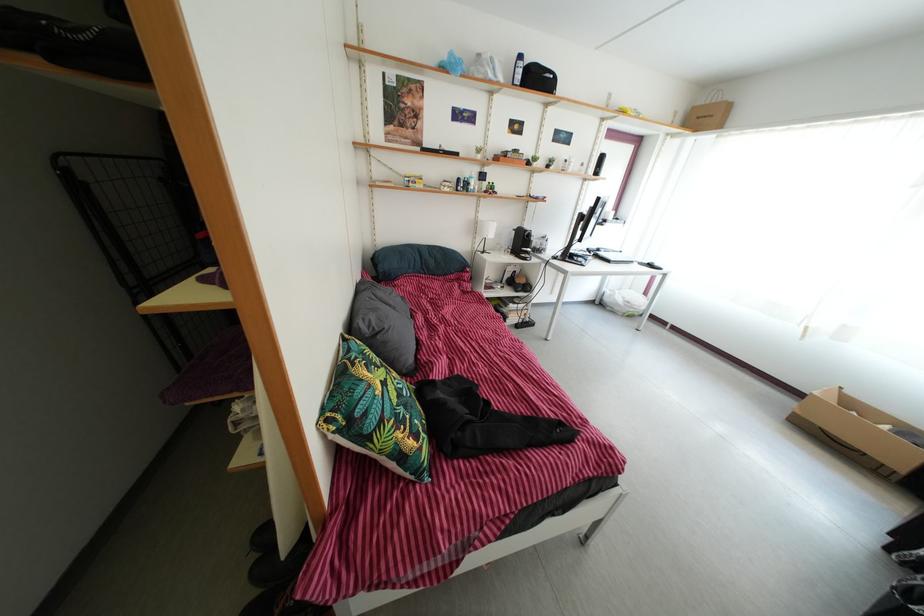
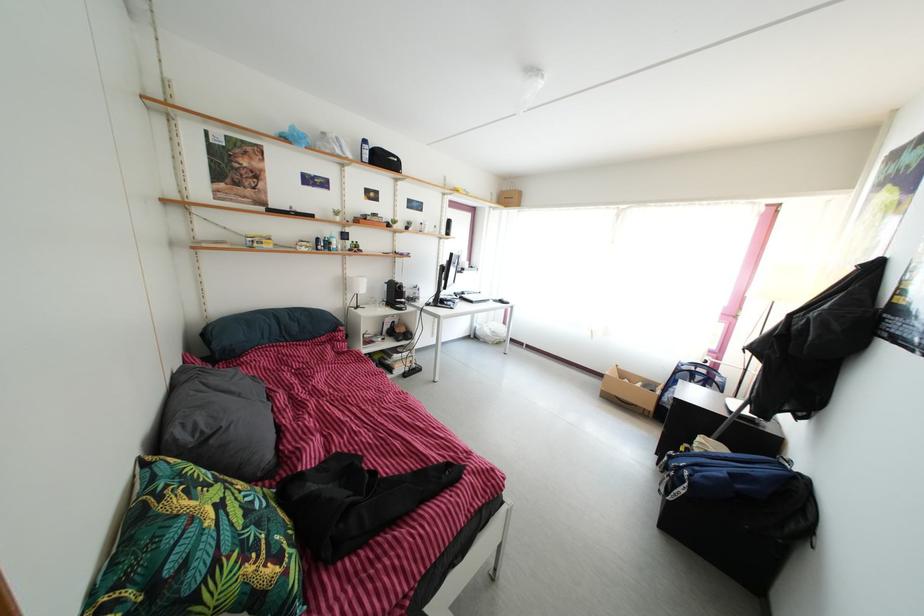
In the second image, find the point that corresponds to pixel 384 345 in the first image.

(217, 450)